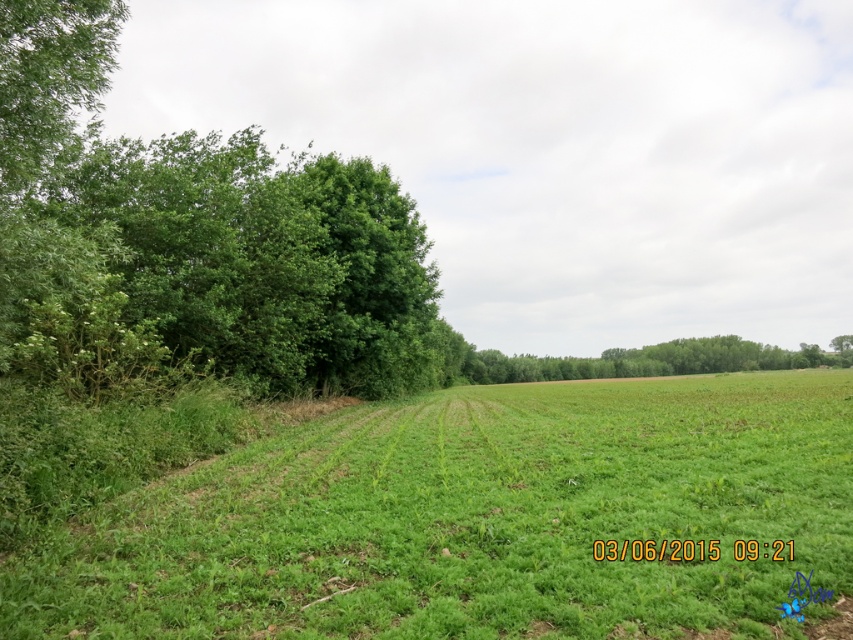
Does point (532, 497) lie behind point (637, 360)?

That is False.

Is green grassy field at lower left to the right of green leafy tree at center from the viewer's perspective?

Incorrect, green grassy field at lower left is not on the right side of green leafy tree at center.

Based on the photo, who is more forward, [630,480] or [851,337]?

Point [630,480] is in front.

The image size is (853, 640). Find the location of `green grassy field at lower left`. green grassy field at lower left is located at coordinates (474, 518).

Is point (252, 228) positioned before point (666, 352)?

Yes, point (252, 228) is in front of point (666, 352).

Is green leafy tree at left behind green leafy tree at center?

No, it is in front of green leafy tree at center.

The width and height of the screenshot is (853, 640). What do you see at coordinates (206, 228) in the screenshot?
I see `green leafy tree at left` at bounding box center [206, 228].

The height and width of the screenshot is (640, 853). I want to click on green leafy tree at left, so click(206, 228).

Who is higher up, green grassy field at lower left or green leafy tree at left?

green leafy tree at left

Measure the distance between point [675,490] and camera.

The distance of point [675,490] from camera is 8.00 meters.

At what (x,y) coordinates should I click in order to perform the action: click on green grassy field at lower left. Please return your answer as a coordinate pair (x, y). The image size is (853, 640). Looking at the image, I should click on (474, 518).